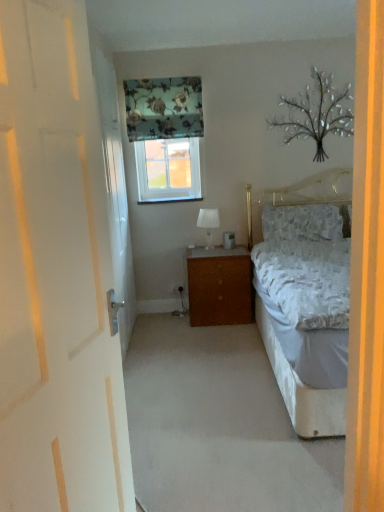
Image resolution: width=384 pixels, height=512 pixels. Find the location of `vacant area situated to the left side of brown wood nightstand at center`. vacant area situated to the left side of brown wood nightstand at center is located at coordinates (157, 323).